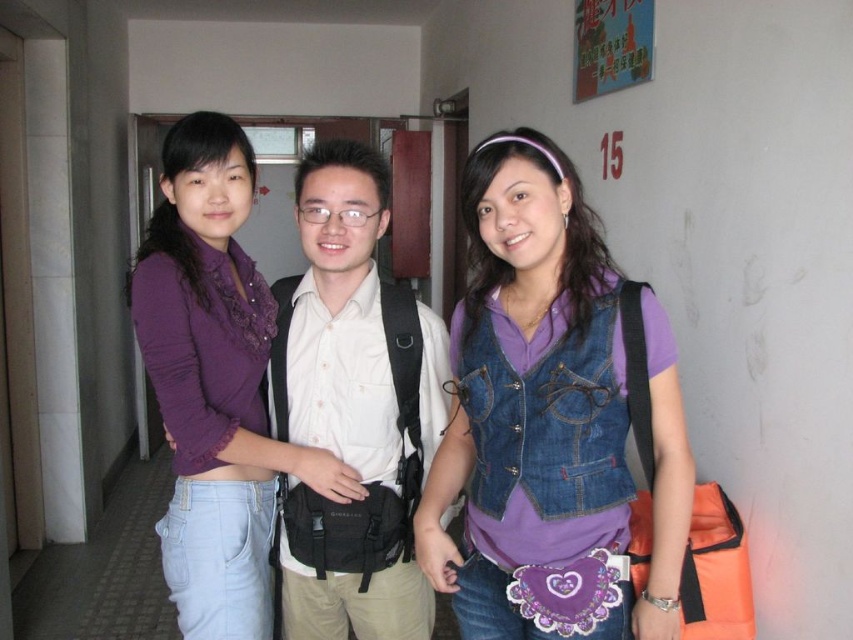
You are standing in the hallway and want to reach a specific point marked at coordinates point (310,353). If your current position is 1.2 meters away from that point, how much farther do you need to move forward to reach it?

The distance of point (310,353) from viewer is 1.55 meters. Since you are currently 1.2 meters away, you need to move an additional 0.35 meters to reach the point.

You are a photographer standing 1.6 meters away from the camera. You want to take a photo of the white matte shirt at center. Can you reach the camera to adjust its position so that you can capture the subject clearly?

The white matte shirt at center is 1.45 meters away from the camera. Since you are standing 1.6 meters away from the camera, you are slightly farther than the subject. To capture the subject clearly, you might need to move closer to the camera or adjust the camera angle so that the white matte shirt at center is in focus.